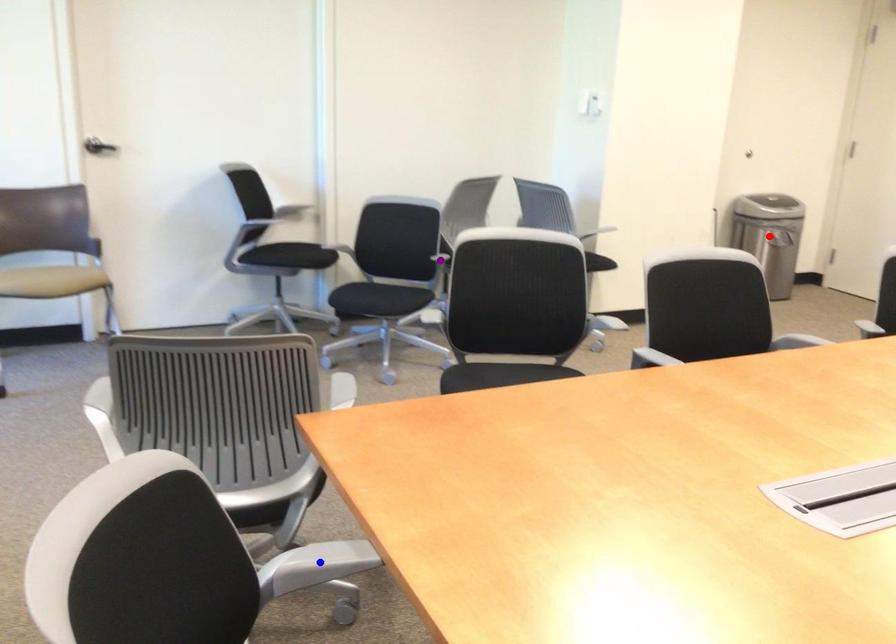
Order these from nearest to farthest:
- red point
- purple point
- blue point

blue point < purple point < red point